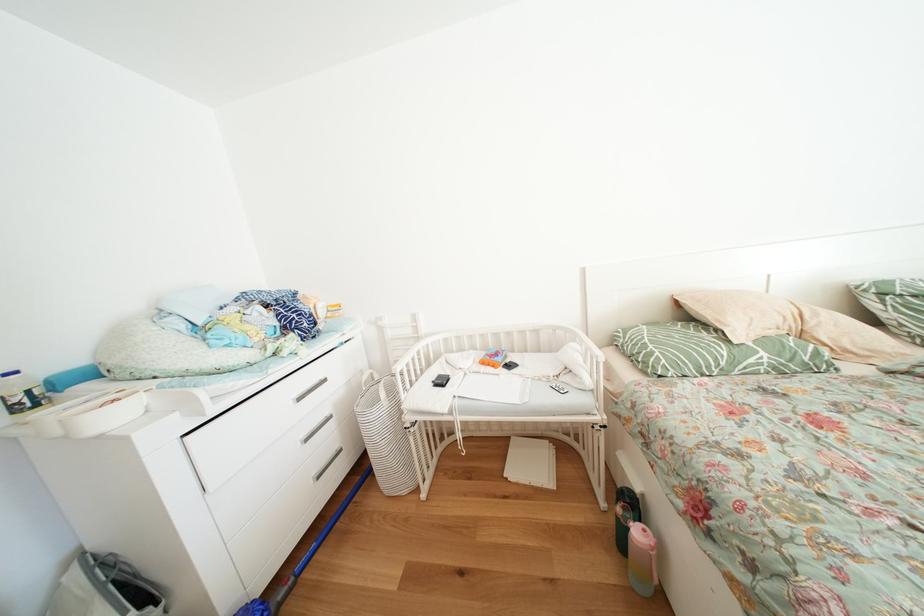
Describe the element at coordinates (20, 392) in the screenshot. Image resolution: width=924 pixels, height=616 pixels. I see `a blue bottle cap` at that location.